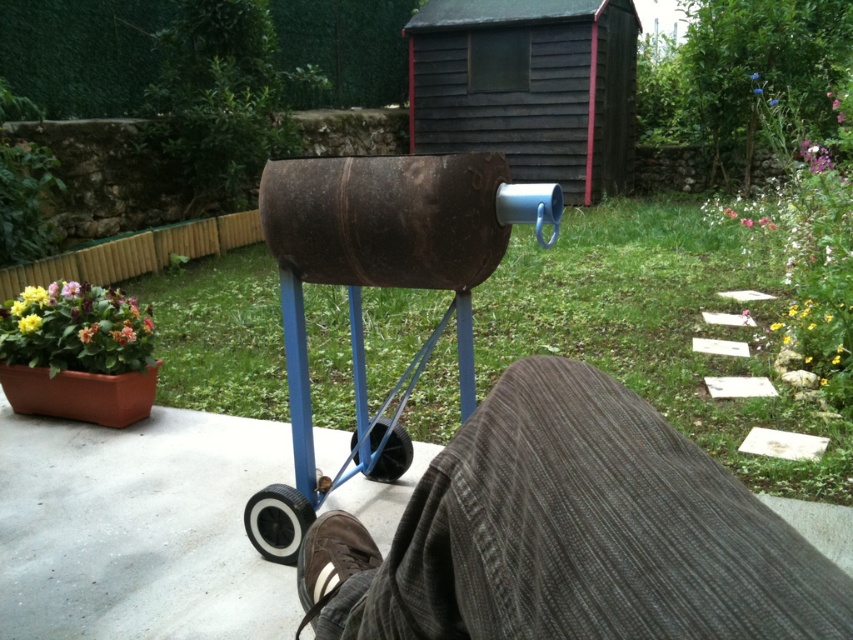
Who is more forward, (x=473, y=387) or (x=383, y=429)?

Point (x=473, y=387) is in front.

Which is more to the right, rusty metal cart at center or black rubber wheel at lower center?

Positioned to the right is black rubber wheel at lower center.

This screenshot has width=853, height=640. I want to click on rusty metal cart at center, so click(387, 260).

Is rusty metal cart at center smaller than rustic wood shed at upper center?

Yes.

Can you confirm if rusty metal cart at center is thinner than rustic wood shed at upper center?

Indeed, rusty metal cart at center has a lesser width compared to rustic wood shed at upper center.

What do you see at coordinates (387, 260) in the screenshot? I see `rusty metal cart at center` at bounding box center [387, 260].

Locate an element on the screen. Image resolution: width=853 pixels, height=640 pixels. rusty metal cart at center is located at coordinates (387, 260).

Between point (453, 513) and point (409, 164), which one is positioned in front?

Point (453, 513) is more forward.

This screenshot has height=640, width=853. Describe the element at coordinates (572, 532) in the screenshot. I see `brown corduroy pants at lower center` at that location.

Locate an element on the screen. brown corduroy pants at lower center is located at coordinates (572, 532).

You are a GUI agent. You are given a task and a screenshot of the screen. Output one action in this format:
    pyautogui.click(x=<x>, y=<y>)
    Task: Click on the brown corduroy pants at lower center
    The image size is (853, 640).
    Given the screenshot: What is the action you would take?
    pyautogui.click(x=572, y=532)